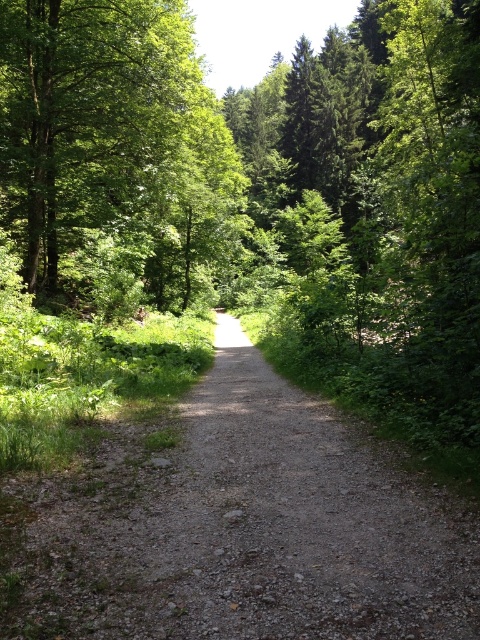
Between gray gravel path at center and green leafy tree at upper left, which one has more height?

With more height is green leafy tree at upper left.

Is point (312, 529) positioned in front of point (59, 285)?

Yes, point (312, 529) is closer to viewer.

Does point (156, 532) lie in front of point (62, 289)?

That is True.

In order to click on gray gravel path at center in this screenshot , I will do `click(245, 528)`.